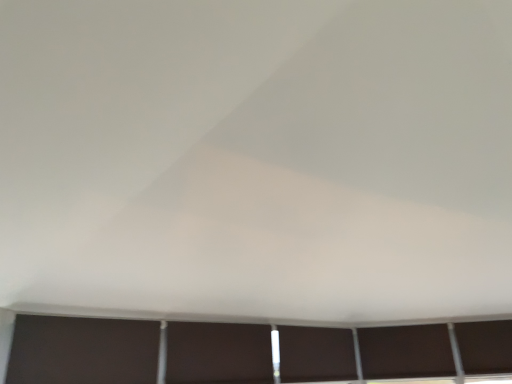
Find the location of a particular element. This screenshot has width=512, height=384. dark brown matte window at lower right, placed as the 1th window when sorted from right to left is located at coordinates (485, 346).

Describe the element at coordinates (485, 346) in the screenshot. The height and width of the screenshot is (384, 512). I see `dark brown matte window at lower right, placed as the 1th window when sorted from right to left` at that location.

Describe the element at coordinates (406, 352) in the screenshot. The width and height of the screenshot is (512, 384). I see `dark matte window at lower right, which ranks as the 2th window in right-to-left order` at that location.

What do you see at coordinates (218, 353) in the screenshot? I see `matte brown shutter at center, the 2th shutter from the left` at bounding box center [218, 353].

Describe the element at coordinates (316, 354) in the screenshot. I see `dark matte window at bottom, the first window from the left` at that location.

At what (x,y) coordinates should I click in order to perform the action: click on dark brown matte window at lower right, which is the 3th window from left to right. Please return your answer as a coordinate pair (x, y). The height and width of the screenshot is (384, 512). Looking at the image, I should click on (485, 346).

Which is correct: dark brown matte window at lower right, which is the 3th window from left to right, is inside dark matte shutter at lower left, the 1th shutter when ordered from front to back, or outside of it?

dark brown matte window at lower right, which is the 3th window from left to right, is spatially situated outside dark matte shutter at lower left, the 1th shutter when ordered from front to back.

Is dark brown matte window at lower right, which is the 3th window from left to right, aimed at dark matte shutter at lower left, which appears as the 1th shutter when viewed from the left?

No.

Between dark brown matte window at lower right, which is the 3th window from left to right, and dark matte shutter at lower left, the 1th shutter when ordered from front to back, which one has smaller width?

With smaller width is dark brown matte window at lower right, which is the 3th window from left to right.

How far apart are dark brown matte window at lower right, placed as the 1th window when sorted from right to left, and dark matte shutter at lower left, arranged as the second shutter when viewed from the back?

dark brown matte window at lower right, placed as the 1th window when sorted from right to left, is 8.47 feet from dark matte shutter at lower left, arranged as the second shutter when viewed from the back.

Which object is positioned more to the left, dark matte shutter at lower left, the 1th shutter when ordered from front to back, or dark matte window at bottom, the first window from the left?

dark matte shutter at lower left, the 1th shutter when ordered from front to back.

Identify the location of window that is the 1st one when counting backward from the dark matte shutter at lower left, arranged as the second shutter when viewed from the back. (316, 354).

Does dark matte shutter at lower left, the 1th shutter when ordered from front to back, turn towards dark matte window at bottom, the first window from the left?

No, dark matte shutter at lower left, the 1th shutter when ordered from front to back, is not turned towards dark matte window at bottom, the first window from the left.

Looking at this image, is dark matte shutter at lower left, arranged as the second shutter when viewed from the back, with dark matte window at bottom, positioned as the 3th window in right-to-left order?

No, dark matte shutter at lower left, arranged as the second shutter when viewed from the back, is not touching dark matte window at bottom, positioned as the 3th window in right-to-left order.

Who is shorter, matte brown shutter at center, the 1th shutter in the right-to-left sequence, or dark matte window at bottom, the first window from the left?

dark matte window at bottom, the first window from the left, is shorter.

Is matte brown shutter at center, the 2th shutter from the left, next to dark matte window at bottom, positioned as the 3th window in right-to-left order?

They are not placed beside each other.

How distant is matte brown shutter at center, which appears as the 2th shutter when viewed from the front, from dark matte window at bottom, the first window from the left?

matte brown shutter at center, which appears as the 2th shutter when viewed from the front, is 17.98 inches away from dark matte window at bottom, the first window from the left.

Is point (172, 351) closer or farther from the camera than point (280, 358)?

Point (172, 351).

How different are the orientations of dark brown matte window at lower right, which is the 3th window from left to right, and dark matte window at bottom, the first window from the left, in degrees?

The angular difference between dark brown matte window at lower right, which is the 3th window from left to right, and dark matte window at bottom, the first window from the left, is 44.5 degrees.

Could you measure the distance between dark brown matte window at lower right, placed as the 1th window when sorted from right to left, and dark matte window at bottom, positioned as the 3th window in right-to-left order?

The distance of dark brown matte window at lower right, placed as the 1th window when sorted from right to left, from dark matte window at bottom, positioned as the 3th window in right-to-left order, is 3.49 feet.

From the image's perspective, is dark brown matte window at lower right, which is the 3th window from left to right, on dark matte window at bottom, the first window from the left?

Correct, dark brown matte window at lower right, which is the 3th window from left to right, appears higher than dark matte window at bottom, the first window from the left, in the image.

Does point (507, 326) come behind point (300, 369)?

That is True.

Is the surface of dark matte window at bottom, the first window from the left, in direct contact with matte brown shutter at center, the first shutter positioned from the back?

No, dark matte window at bottom, the first window from the left, is not beside matte brown shutter at center, the first shutter positioned from the back.

How different are the orientations of dark matte window at bottom, positioned as the 3th window in right-to-left order, and matte brown shutter at center, the 2th shutter from the left, in degrees?

There is a 0.00591-degree angle between the facing directions of dark matte window at bottom, positioned as the 3th window in right-to-left order, and matte brown shutter at center, the 2th shutter from the left.

Measure the distance between dark matte window at bottom, positioned as the 3th window in right-to-left order, and matte brown shutter at center, which appears as the 2th shutter when viewed from the front.

A distance of 17.98 inches exists between dark matte window at bottom, positioned as the 3th window in right-to-left order, and matte brown shutter at center, which appears as the 2th shutter when viewed from the front.

Which is correct: dark matte window at bottom, the first window from the left, is inside matte brown shutter at center, the 1th shutter in the right-to-left sequence, or outside of it?

dark matte window at bottom, the first window from the left, is located beyond the bounds of matte brown shutter at center, the 1th shutter in the right-to-left sequence.

Considering the relative sizes of dark matte shutter at lower left, the 1th shutter when ordered from front to back, and dark brown matte window at lower right, placed as the 1th window when sorted from right to left, in the image provided, is dark matte shutter at lower left, the 1th shutter when ordered from front to back, wider than dark brown matte window at lower right, placed as the 1th window when sorted from right to left,?

Yes.

Can you tell me how much dark matte shutter at lower left, the 1th shutter when ordered from front to back, and dark brown matte window at lower right, which is the 3th window from left to right, differ in facing direction?

They differ by 45.9 degrees in their facing directions.

Considering the relative sizes of dark matte shutter at lower left, arranged as the second shutter when viewed from the back, and dark brown matte window at lower right, placed as the 1th window when sorted from right to left, in the image provided, is dark matte shutter at lower left, arranged as the second shutter when viewed from the back, smaller than dark brown matte window at lower right, placed as the 1th window when sorted from right to left,?

No, dark matte shutter at lower left, arranged as the second shutter when viewed from the back, is not smaller than dark brown matte window at lower right, placed as the 1th window when sorted from right to left.

In terms of height, does matte brown shutter at center, which appears as the 2th shutter when viewed from the front, look taller or shorter compared to dark matte shutter at lower left, which appears as the 1th shutter when viewed from the left?

matte brown shutter at center, which appears as the 2th shutter when viewed from the front, is taller than dark matte shutter at lower left, which appears as the 1th shutter when viewed from the left.

Could you measure the distance between matte brown shutter at center, the 2th shutter from the left, and dark matte shutter at lower left, the 1th shutter when ordered from front to back?

A distance of 17.37 inches exists between matte brown shutter at center, the 2th shutter from the left, and dark matte shutter at lower left, the 1th shutter when ordered from front to back.

Considering the relative positions of matte brown shutter at center, the 2th shutter from the left, and dark matte shutter at lower left, arranged as the second shutter when viewed from the back, in the image provided, is matte brown shutter at center, the 2th shutter from the left, to the left or to the right of dark matte shutter at lower left, arranged as the second shutter when viewed from the back,?

Clearly, matte brown shutter at center, the 2th shutter from the left, is on the right of dark matte shutter at lower left, arranged as the second shutter when viewed from the back, in the image.

In terms of width, does matte brown shutter at center, which appears as the 2th shutter when viewed from the front, look wider or thinner when compared to dark matte shutter at lower left, arranged as the second shutter when viewed from the back?

Considering their sizes, matte brown shutter at center, which appears as the 2th shutter when viewed from the front, looks broader than dark matte shutter at lower left, arranged as the second shutter when viewed from the back.

This screenshot has width=512, height=384. Find the location of `the 2nd shutter counting from the left of the dark brown matte window at lower right, placed as the 1th window when sorted from right to left`. the 2nd shutter counting from the left of the dark brown matte window at lower right, placed as the 1th window when sorted from right to left is located at coordinates (82, 350).

Identify the location of the 3rd window positioned below the dark matte shutter at lower left, arranged as the second shutter when viewed from the back (from a real-world perspective). The image size is (512, 384). (316, 354).

Consider the image. When comparing their distances from matte brown shutter at center, the first shutter positioned from the back, does dark matte window at bottom, the first window from the left, or dark matte window at lower right, which ranks as the 2th window in right-to-left order, seem closer?

dark matte window at bottom, the first window from the left, is positioned closer to the anchor matte brown shutter at center, the first shutter positioned from the back.

From the image, which object appears to be nearer to dark matte shutter at lower left, which appears as the 2th shutter when viewed from the right, matte brown shutter at center, the first shutter positioned from the back, or dark matte window at bottom, the first window from the left?

Among the two, matte brown shutter at center, the first shutter positioned from the back, is located nearer to dark matte shutter at lower left, which appears as the 2th shutter when viewed from the right.

Considering their positions, is dark matte window at lower right, which ranks as the 2th window in right-to-left order, positioned further to matte brown shutter at center, the 1th shutter in the right-to-left sequence, than dark brown matte window at lower right, which is the 3th window from left to right?

dark brown matte window at lower right, which is the 3th window from left to right, is further to matte brown shutter at center, the 1th shutter in the right-to-left sequence.

Which object lies nearer to the anchor point dark brown matte window at lower right, placed as the 1th window when sorted from right to left, dark matte shutter at lower left, which appears as the 1th shutter when viewed from the left, or dark matte window at bottom, positioned as the 3th window in right-to-left order?

dark matte window at bottom, positioned as the 3th window in right-to-left order.

Looking at the image, which one is located closer to dark matte window at lower right, which ranks as the 2th window in left-to-right order, dark matte window at bottom, the first window from the left, or matte brown shutter at center, the 2th shutter from the left?

Based on the image, dark matte window at bottom, the first window from the left, appears to be nearer to dark matte window at lower right, which ranks as the 2th window in left-to-right order.

Based on their spatial positions, is dark brown matte window at lower right, which is the 3th window from left to right, or dark matte window at bottom, positioned as the 3th window in right-to-left order, closer to dark matte window at lower right, which ranks as the 2th window in left-to-right order?

The object closer to dark matte window at lower right, which ranks as the 2th window in left-to-right order, is dark brown matte window at lower right, which is the 3th window from left to right.

Based on their spatial positions, is matte brown shutter at center, the 1th shutter in the right-to-left sequence, or dark brown matte window at lower right, placed as the 1th window when sorted from right to left, closer to dark matte window at bottom, positioned as the 3th window in right-to-left order?

Among the two, matte brown shutter at center, the 1th shutter in the right-to-left sequence, is located nearer to dark matte window at bottom, positioned as the 3th window in right-to-left order.

Looking at the image, which one is located closer to dark matte window at bottom, positioned as the 3th window in right-to-left order, dark brown matte window at lower right, which is the 3th window from left to right, or dark matte window at lower right, which ranks as the 2th window in right-to-left order?

The object closer to dark matte window at bottom, positioned as the 3th window in right-to-left order, is dark matte window at lower right, which ranks as the 2th window in right-to-left order.

What are the coordinates of `shutter situated between dark matte shutter at lower left, arranged as the second shutter when viewed from the back, and dark matte window at bottom, positioned as the 3th window in right-to-left order, from left to right` in the screenshot? It's located at (218, 353).

You are a GUI agent. You are given a task and a screenshot of the screen. Output one action in this format:
    pyautogui.click(x=<x>, y=<y>)
    Task: Click on the shutter situated between dark matte shutter at lower left, the 1th shutter when ordered from front to back, and dark matte window at lower right, which ranks as the 2th window in right-to-left order, from left to right
    
    Given the screenshot: What is the action you would take?
    pyautogui.click(x=218, y=353)

The image size is (512, 384). I want to click on window between dark matte shutter at lower left, arranged as the second shutter when viewed from the back, and dark matte window at lower right, which ranks as the 2th window in left-to-right order, so click(316, 354).

You are a GUI agent. You are given a task and a screenshot of the screen. Output one action in this format:
    pyautogui.click(x=<x>, y=<y>)
    Task: Click on the window situated between dark matte window at bottom, the first window from the left, and dark brown matte window at lower right, placed as the 1th window when sorted from right to left, from left to right
    The height and width of the screenshot is (384, 512).
    Given the screenshot: What is the action you would take?
    pyautogui.click(x=406, y=352)